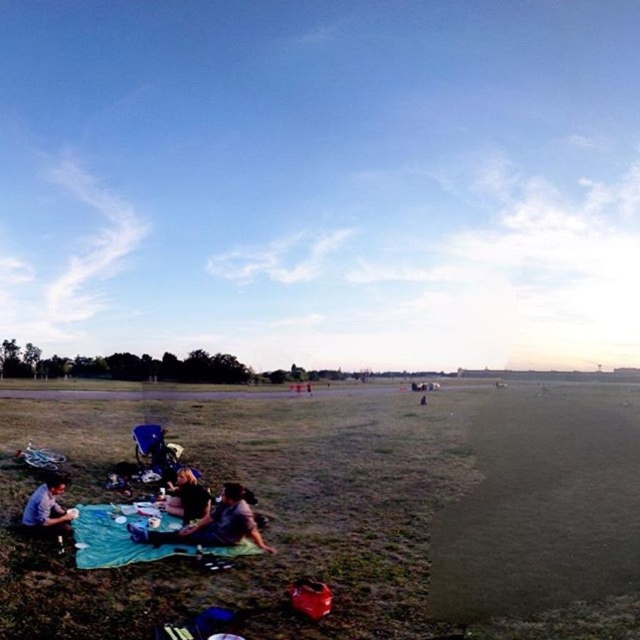
You are a drone operator tasked with capturing aerial footage of the picnic scene. Your drone has a maximum flight range of 10 meters. If you position the drone above the dark gray fabric at lower center, can it reach the dark brown hair at lower left without exceeding its range?

The distance between the dark gray fabric at lower center and the dark brown hair at lower left is 10.78 meters, which exceeds the drone operator drone maximum flight range of 10 meters. Therefore, the drone cannot reach the dark brown hair at lower left without exceeding its range.

You are at the park and see a blue fabric picnic blanket at lower left and a matte blue shirt at lower left. Which object is positioned more to the left?

The matte blue shirt at lower left is positioned more to the left than the blue fabric picnic blanket at lower left.